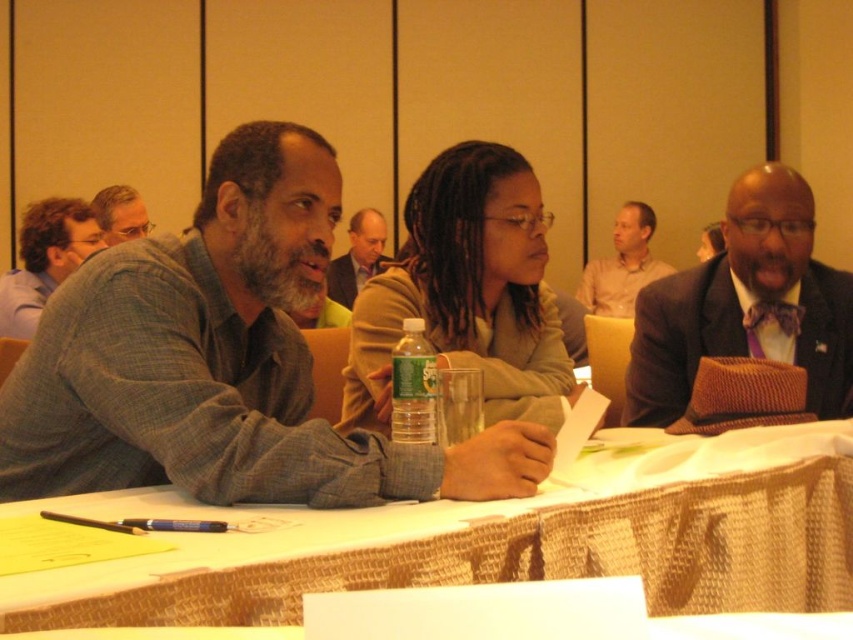
In the conference room scene, there is a brown textured hat at right and a matte gray shirt at left. Which object is wider?

The brown textured hat at right is wider than the matte gray shirt at left.

You are organizing a meeting and need to place a 30 cm wide laptop between the white woven tablecloth at center and the clear plastic bottle at center. Is there enough space?

The distance between the white woven tablecloth at center and the clear plastic bottle at center is 33.35 centimeters. Since the laptop is 30 cm wide, there is enough space to place it between them.